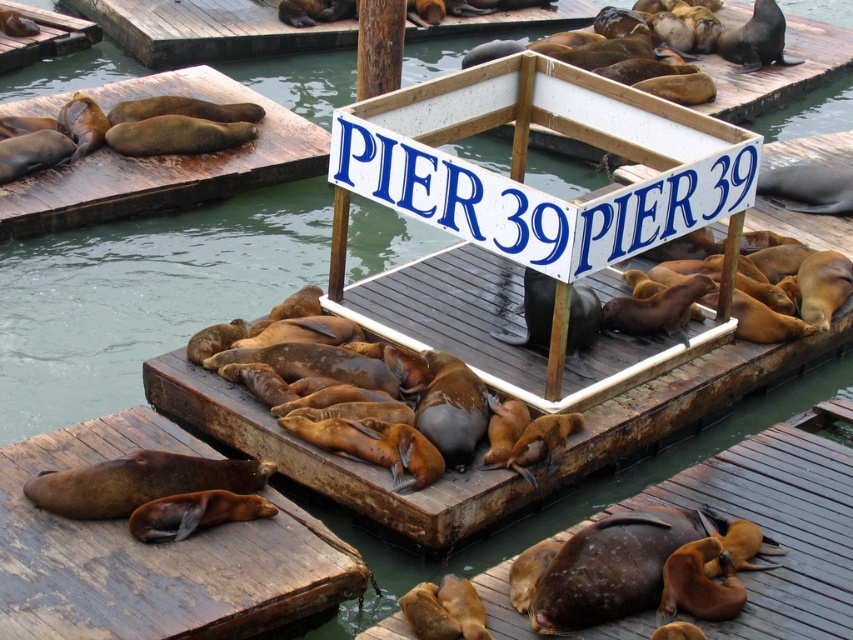
You are standing at the entrance of Pier 39 and see the brown matte dock at lower center and the brown wood dock at upper left. Which dock is closer to the entrance?

The brown matte dock at lower center is closer to the entrance because it is located below the brown wood dock at upper left, meaning it is positioned lower in the scene and likely nearer to the viewer.

You are standing on the brown wood dock at lower left and want to climb onto the brown wood dock at upper left. Based on the scene description, can you determine if the climb will be easy or difficult?

The brown wood dock at lower left has a lesser height compared to brown wood dock at upper left, so the climb may be difficult due to the height difference between the two docks.